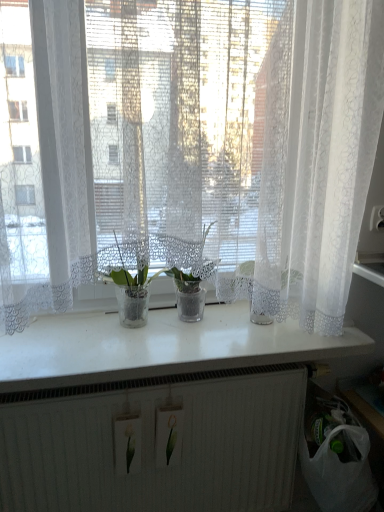
You are a GUI agent. You are given a task and a screenshot of the screen. Output one action in this format:
    pyautogui.click(x=<x>, y=<y>)
    Task: Click on the vacant space to the left of clear glass vase at center, acting as the second houseplant starting from the right
    The image size is (384, 512).
    Given the screenshot: What is the action you would take?
    pyautogui.click(x=68, y=329)